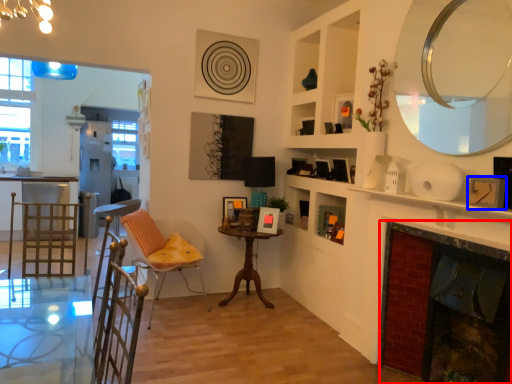
Question: Which point is further to the camera, fireplace (highlighted by a red box) or picture frame (highlighted by a blue box)?

Choices:
 (A) fireplace
 (B) picture frame

Answer: (B)